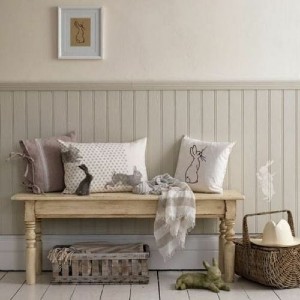
Identify the location of off white wainscotting. (251, 117).